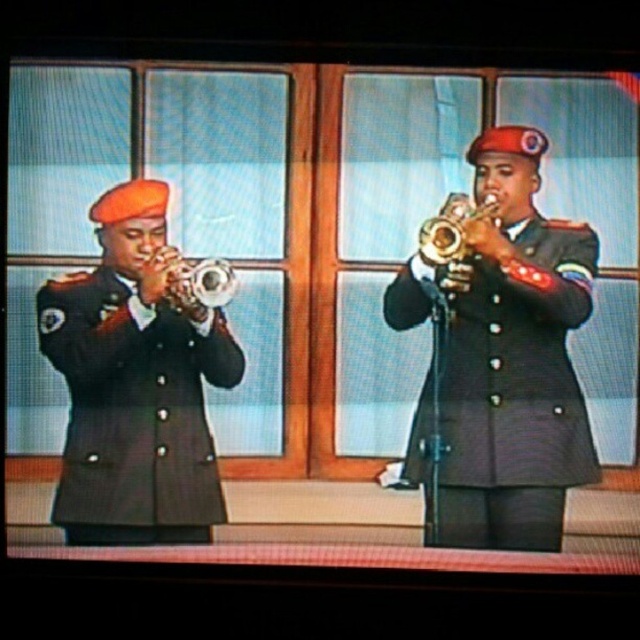
Question: Which of the following is the farthest from the observer?

Choices:
 (A) gold shiny trumpet at center
 (B) brushed metal trumpet at left

Answer: (A)

Question: Considering the relative positions of gold shiny trumpet at center and brushed metal trumpet at left in the image provided, where is gold shiny trumpet at center located with respect to brushed metal trumpet at left?

Choices:
 (A) below
 (B) above

Answer: (B)

Question: Among these objects, which one is nearest to the camera?

Choices:
 (A) matte black trumpet at left
 (B) gold shiny trumpet at center
 (C) black matte uniform at center
 (D) brushed metal trumpet at left

Answer: (A)

Question: In this image, where is black matte uniform at center located relative to brushed metal trumpet at left?

Choices:
 (A) below
 (B) above

Answer: (A)

Question: Which object is the farthest from the brushed metal trumpet at left?

Choices:
 (A) gold shiny trumpet at center
 (B) black matte uniform at center
 (C) matte black trumpet at left

Answer: (B)

Question: Is the position of matte black trumpet at left more distant than that of black matte uniform at center?

Choices:
 (A) no
 (B) yes

Answer: (A)